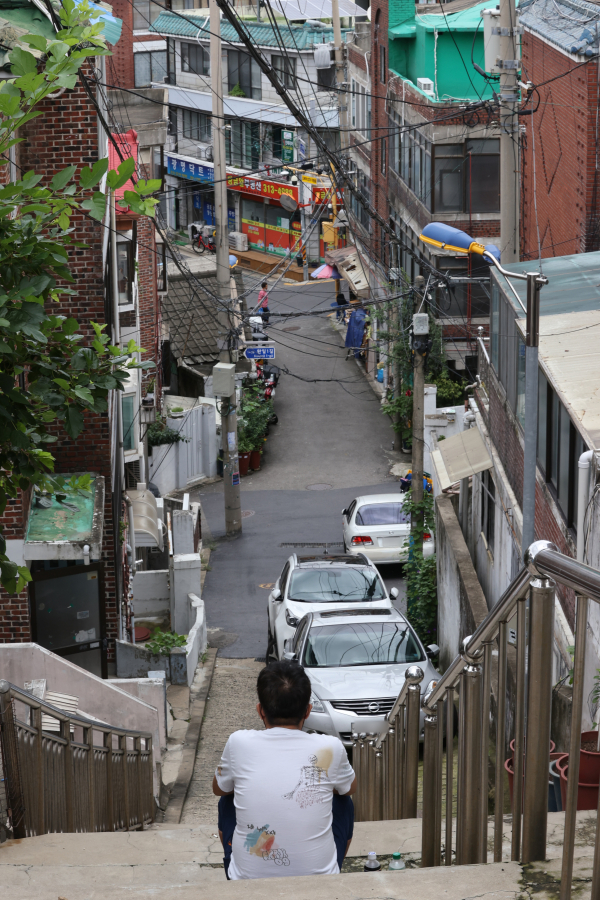
You are a GUI agent. You are given a task and a screenshot of the screen. Output one action in this format:
    pyautogui.click(x=<x>, y=<y>)
    Task: Click on the stairs
    This screenshot has width=600, height=900.
    Given the screenshot: What is the action you would take?
    pyautogui.click(x=155, y=851)